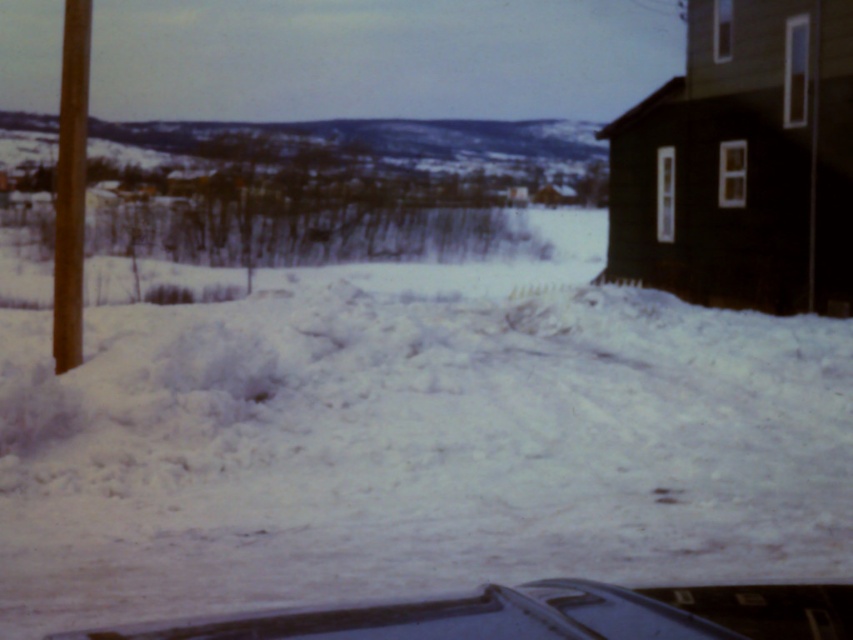
Question: Which of the following is the farthest from the observer?

Choices:
 (A) pos(3,259)
 (B) pos(68,147)

Answer: (A)

Question: Is white fluffy snow at center to the left of brown wooden pole at left from the viewer's perspective?

Choices:
 (A) no
 (B) yes

Answer: (A)

Question: Can you confirm if white fluffy snow at center is thinner than brown wooden pole at left?

Choices:
 (A) no
 (B) yes

Answer: (A)

Question: Which object is the closest to the white fluffy snow at center?

Choices:
 (A) shiny black car at lower center
 (B) brown wooden pole at left

Answer: (B)

Question: In this image, where is white fluffy snow at center located relative to brown wooden pole at left?

Choices:
 (A) right
 (B) left

Answer: (A)

Question: Which object is closer to the camera taking this photo?

Choices:
 (A) white fluffy snow at center
 (B) brown wooden pole at left

Answer: (A)